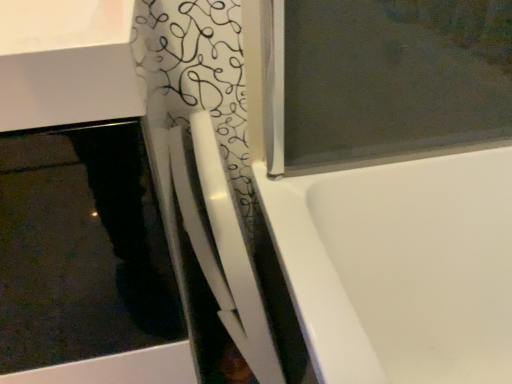
Question: Should I look upward or downward to see white glossy shower door at center?

Choices:
 (A) up
 (B) down

Answer: (B)

Question: Is white glossy sink at upper left shorter than white glossy shower door at center?

Choices:
 (A) yes
 (B) no

Answer: (B)

Question: Could you tell me if white glossy sink at upper left is turned towards white glossy shower door at center?

Choices:
 (A) yes
 (B) no

Answer: (B)

Question: Is white glossy sink at upper left surrounding white glossy shower door at center?

Choices:
 (A) no
 (B) yes

Answer: (A)

Question: Is white glossy sink at upper left to the right of white glossy shower door at center from the viewer's perspective?

Choices:
 (A) no
 (B) yes

Answer: (A)

Question: From a real-world perspective, does white glossy sink at upper left sit lower than white glossy shower door at center?

Choices:
 (A) yes
 (B) no

Answer: (A)

Question: Considering the relative sizes of white glossy sink at upper left and white glossy shower door at center in the image provided, is white glossy sink at upper left smaller than white glossy shower door at center?

Choices:
 (A) yes
 (B) no

Answer: (B)

Question: Is white glossy shower door at center positioned before white glossy sink at upper left?

Choices:
 (A) yes
 (B) no

Answer: (B)

Question: Is white glossy shower door at center thinner than white glossy sink at upper left?

Choices:
 (A) no
 (B) yes

Answer: (B)

Question: Can you confirm if white glossy shower door at center is shorter than white glossy sink at upper left?

Choices:
 (A) yes
 (B) no

Answer: (A)

Question: Considering the relative sizes of white glossy shower door at center and white glossy sink at upper left in the image provided, is white glossy shower door at center wider than white glossy sink at upper left?

Choices:
 (A) yes
 (B) no

Answer: (B)

Question: Is white glossy shower door at center smaller than white glossy sink at upper left?

Choices:
 (A) no
 (B) yes

Answer: (B)

Question: From a real-world perspective, is white glossy shower door at center located higher than white glossy sink at upper left?

Choices:
 (A) no
 (B) yes

Answer: (B)

Question: In terms of size, does white glossy sink at upper left appear bigger or smaller than white glossy shower door at center?

Choices:
 (A) small
 (B) big

Answer: (B)